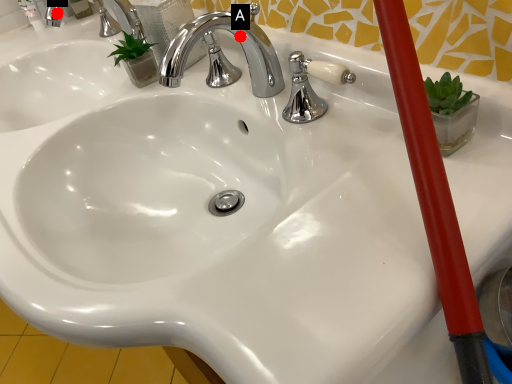
Question: Two points are circled on the image, labeled by A and B beside each circle. Which point is farther from the camera taking this photo?

Choices:
 (A) A is further
 (B) B is further

Answer: (B)